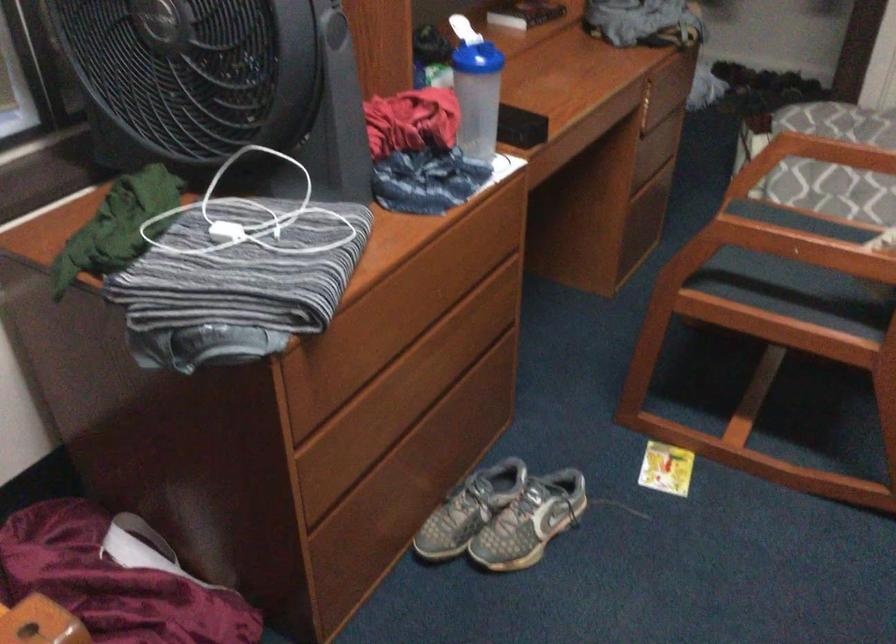
Describe the element at coordinates (826, 234) in the screenshot. The image size is (896, 644). I see `a chair sitting surface` at that location.